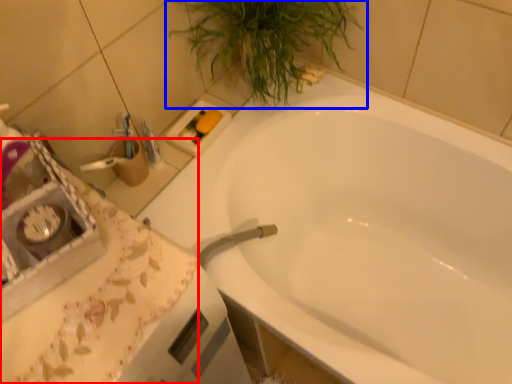
Question: Which object appears closest to the camera in this image, counter top (highlighted by a red box) or houseplant (highlighted by a blue box)?

Choices:
 (A) counter top
 (B) houseplant

Answer: (A)